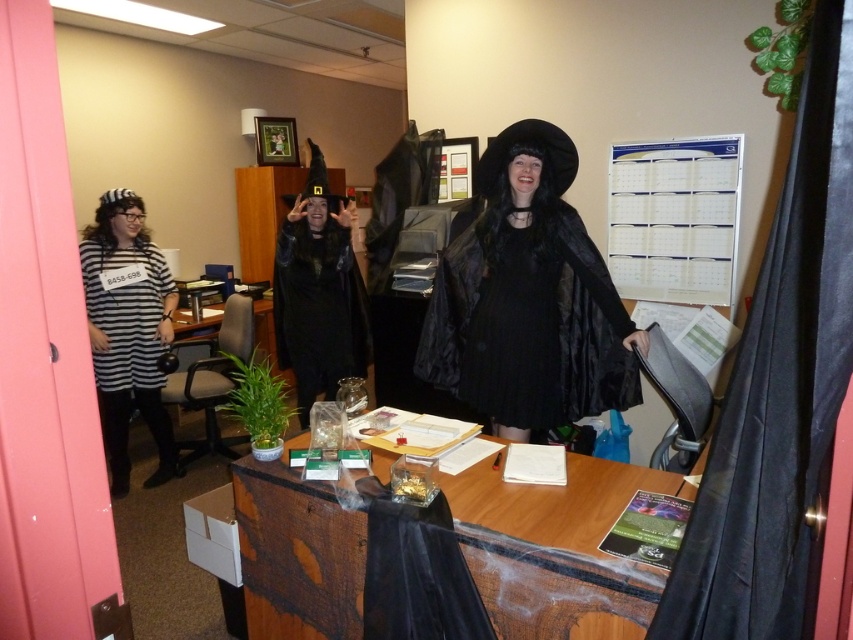
Question: Which of the following is the closest to the observer?

Choices:
 (A) (341, 612)
 (B) (527, 252)
 (C) (282, 314)

Answer: (A)

Question: Which object is positioned closest to the striped fabric shirt at left?

Choices:
 (A) black matte robe at center
 (B) wooden table at center

Answer: (A)

Question: Does wooden table at center have a larger size compared to striped fabric shirt at left?

Choices:
 (A) no
 (B) yes

Answer: (B)

Question: Is wooden table at center closer to camera compared to matte black dress at center?

Choices:
 (A) no
 (B) yes

Answer: (B)

Question: Does matte black dress at center have a smaller size compared to striped fabric shirt at left?

Choices:
 (A) no
 (B) yes

Answer: (B)

Question: Which object is the closest to the matte black dress at center?

Choices:
 (A) black matte robe at center
 (B) striped fabric shirt at left
 (C) wooden table at center

Answer: (C)